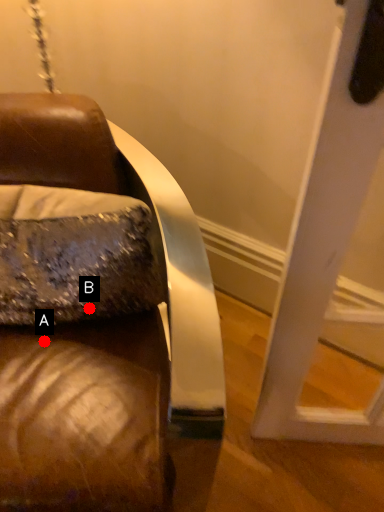
Question: Two points are circled on the image, labeled by A and B beside each circle. Which point is further to the camera?

Choices:
 (A) A is further
 (B) B is further

Answer: (A)